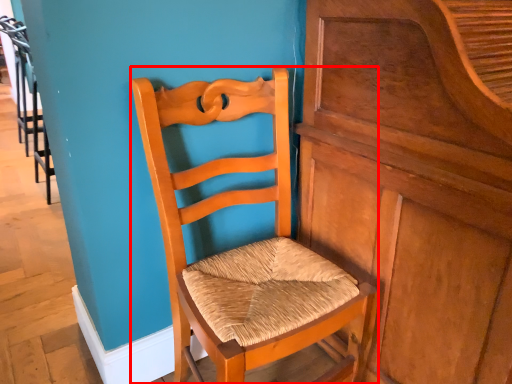
Question: From the image's perspective, what is the correct spatial positioning of chair (annotated by the red box) in reference to dresser?

Choices:
 (A) above
 (B) below

Answer: (B)